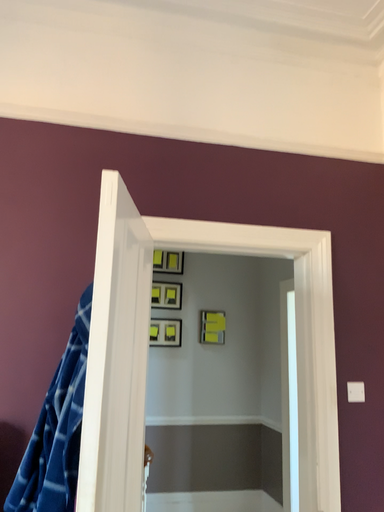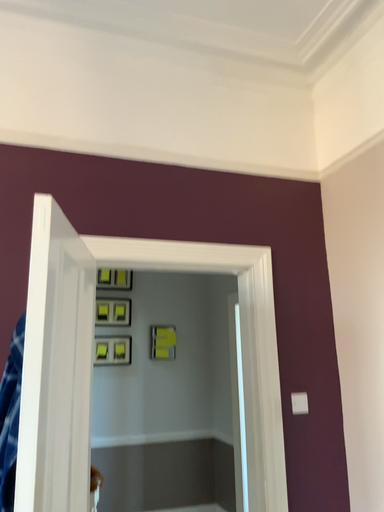
Question: Which way did the camera rotate in the video?

Choices:
 (A) rotated left
 (B) rotated right

Answer: (B)